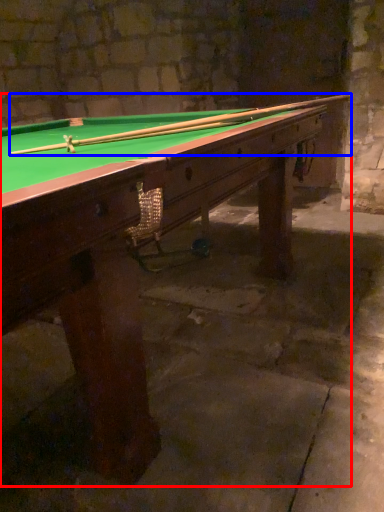
Question: Which point is further to the camera, billiard table (highlighted by a red box) or cue (highlighted by a blue box)?

Choices:
 (A) billiard table
 (B) cue

Answer: (B)